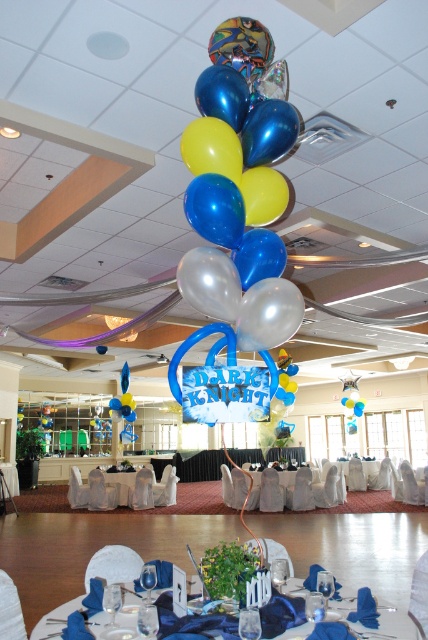
You are standing in the banquet hall and want to move from the point at coordinates point (398, 637) to the point at coordinates point (231, 237). Which direction should you move to reach your destination?

Since point (398, 637) is behind point (231, 237), you should move forward to reach your destination.

You are standing in the banquet hall and want to locate the point at coordinates (214, 209). According to the image, where would this point be located?

The point at coordinates (214, 209) is located on the blue metallic balloon at center.

From the picture: You are a guest at the event and want to take a photo of the blue metallic balloon at center without any obstructions. Since the white fabric table at center is in the way, can you stand behind it to get a clear shot of the balloon?

The blue metallic balloon at center is shorter than the white fabric table at center, so standing behind the table might still block the view of the balloon since the table is taller.